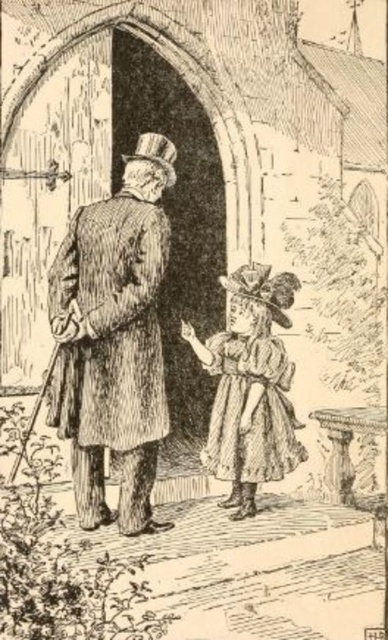
Question: Does brown textured coat at center have a greater width compared to matte brown dress at center?

Choices:
 (A) no
 (B) yes

Answer: (A)

Question: Which of the following is the farthest from the observer?

Choices:
 (A) (277, 280)
 (B) (98, 365)

Answer: (A)

Question: Among these points, which one is nearest to the camera?

Choices:
 (A) (270, 346)
 (B) (81, 392)

Answer: (B)

Question: Can you confirm if brown textured coat at center is thinner than matte brown dress at center?

Choices:
 (A) yes
 (B) no

Answer: (A)

Question: Does brown textured coat at center have a larger size compared to matte brown dress at center?

Choices:
 (A) yes
 (B) no

Answer: (B)